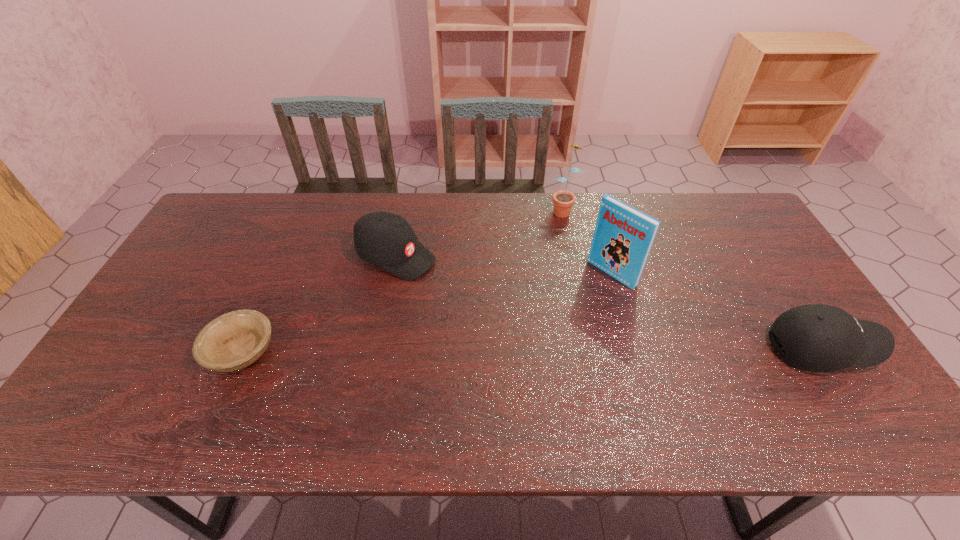
Find the location of a particular element. object that is the closest to the left baseball cap is located at coordinates (233, 341).

At what (x,y) coordinates should I click in order to perform the action: click on vacant space that satisfies the following two spatial constraints: 1. on the front side of the book; 2. on the right side of the sunflower. Please return your answer as a coordinate pair (x, y). Looking at the image, I should click on (577, 274).

Locate an element on the screen. The width and height of the screenshot is (960, 540). vacant area that satisfies the following two spatial constraints: 1. on the front side of the farthest object; 2. on the front-facing side of the right baseball cap is located at coordinates (592, 348).

The width and height of the screenshot is (960, 540). What are the coordinates of `vacant region that satisfies the following two spatial constraints: 1. on the front side of the book; 2. on the right side of the farther baseball cap` in the screenshot? It's located at (393, 274).

You are a GUI agent. You are given a task and a screenshot of the screen. Output one action in this format:
    pyautogui.click(x=<x>, y=<y>)
    Task: Click on the vacant point that satisfies the following two spatial constraints: 1. on the front side of the nearer baseball cap; 2. on the front-facing side of the sunflower
    Image resolution: width=960 pixels, height=540 pixels.
    Given the screenshot: What is the action you would take?
    pyautogui.click(x=592, y=348)

Image resolution: width=960 pixels, height=540 pixels. I want to click on vacant space that satisfies the following two spatial constraints: 1. on the front side of the second object from left to right; 2. on the front-facing side of the nearer baseball cap, so click(x=378, y=348).